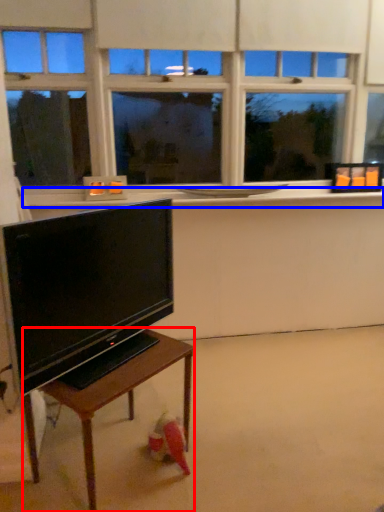
Question: Which object appears farthest to the camera in this image, table (highlighted by a red box) or window sill (highlighted by a blue box)?

Choices:
 (A) table
 (B) window sill

Answer: (B)